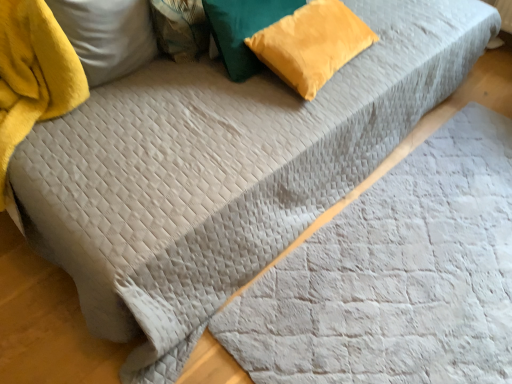
Question: Can you confirm if velvet yellow pillow at upper right, which is the first pillow from right to left, is positioned to the left of gray quilted blanket at center?

Choices:
 (A) yes
 (B) no

Answer: (A)

Question: Is velvet yellow pillow at upper right, positioned as the third pillow in left-to-right order, at the right side of gray quilted blanket at center?

Choices:
 (A) no
 (B) yes

Answer: (A)

Question: Can you confirm if velvet yellow pillow at upper right, positioned as the third pillow in left-to-right order, is smaller than gray quilted blanket at center?

Choices:
 (A) yes
 (B) no

Answer: (A)

Question: Can you confirm if velvet yellow pillow at upper right, positioned as the third pillow in left-to-right order, is bigger than gray quilted blanket at center?

Choices:
 (A) no
 (B) yes

Answer: (A)

Question: Is velvet yellow pillow at upper right, which is the first pillow from right to left, not near gray quilted blanket at center?

Choices:
 (A) no
 (B) yes

Answer: (A)

Question: Is the surface of velvet yellow pillow at upper right, which is the first pillow from right to left, in direct contact with gray quilted blanket at center?

Choices:
 (A) yes
 (B) no

Answer: (B)

Question: From a real-world perspective, is velvet yellow pillow at upper center, the 2th pillow viewed from the right, on velvet yellow pillow at upper right, which is the first pillow from right to left?

Choices:
 (A) no
 (B) yes

Answer: (B)

Question: From the image's perspective, is velvet yellow pillow at upper center, the 2th pillow in the left-to-right sequence, on velvet yellow pillow at upper right, positioned as the third pillow in left-to-right order?

Choices:
 (A) yes
 (B) no

Answer: (A)

Question: Does velvet yellow pillow at upper center, the 2th pillow viewed from the right, have a lesser height compared to velvet yellow pillow at upper right, which is the first pillow from right to left?

Choices:
 (A) no
 (B) yes

Answer: (A)

Question: From a real-world perspective, is velvet yellow pillow at upper center, the 2th pillow in the left-to-right sequence, beneath velvet yellow pillow at upper right, positioned as the third pillow in left-to-right order?

Choices:
 (A) yes
 (B) no

Answer: (B)

Question: Are velvet yellow pillow at upper center, the 2th pillow viewed from the right, and velvet yellow pillow at upper right, which is the first pillow from right to left, located far from each other?

Choices:
 (A) yes
 (B) no

Answer: (B)

Question: Can you confirm if velvet yellow pillow at upper center, the 2th pillow viewed from the right, is positioned to the left of velvet yellow pillow at upper right, positioned as the third pillow in left-to-right order?

Choices:
 (A) no
 (B) yes

Answer: (B)

Question: Is velvet yellow pillow at upper center, the 2th pillow viewed from the right, facing away from yellow velvet pillow at upper left, acting as the 1th pillow starting from the left?

Choices:
 (A) yes
 (B) no

Answer: (B)